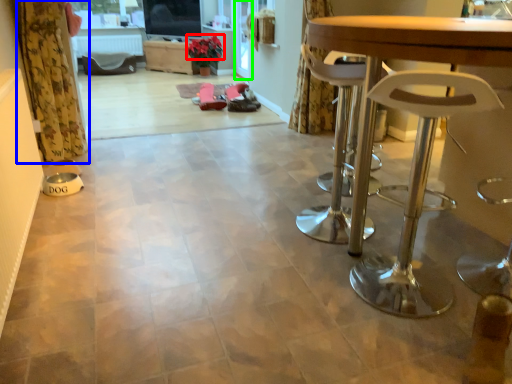
Question: Based on their relative distances, which object is nearer to flower (highlighted by a red box)? Choose from curtain (highlighted by a blue box) and screen door (highlighted by a green box).

Choices:
 (A) curtain
 (B) screen door

Answer: (B)